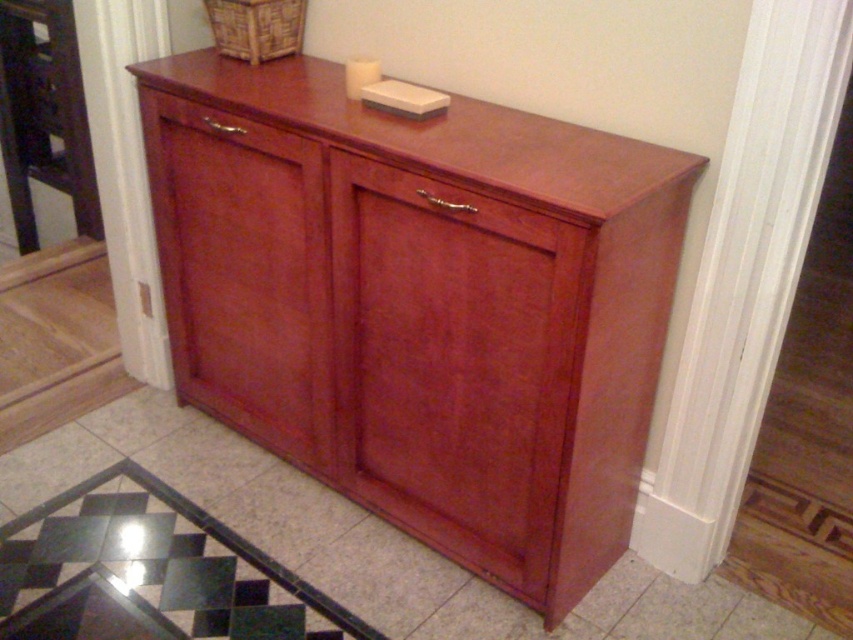
Does point (643, 371) come closer to viewer compared to point (184, 106)?

Yes.

Which is in front, point (656, 321) or point (216, 134)?

Point (656, 321) is more forward.

The height and width of the screenshot is (640, 853). I want to click on satin cherry dresser at center, so click(x=425, y=308).

Who is taller, glossy wood drawer at center or matte wood drawer at center?

glossy wood drawer at center is taller.

Is glossy wood drawer at center behind matte wood drawer at center?

That is False.

This screenshot has height=640, width=853. Find the location of `glossy wood drawer at center`. glossy wood drawer at center is located at coordinates (444, 205).

Does satin cherry dresser at center appear on the right side of glossy wood drawer at center?

In fact, satin cherry dresser at center is to the left of glossy wood drawer at center.

Looking at this image, does satin cherry dresser at center have a lesser height compared to glossy wood drawer at center?

Incorrect, satin cherry dresser at center's height does not fall short of glossy wood drawer at center's.

Describe the element at coordinates (425, 308) in the screenshot. I see `satin cherry dresser at center` at that location.

Where is `satin cherry dresser at center`? satin cherry dresser at center is located at coordinates (425, 308).